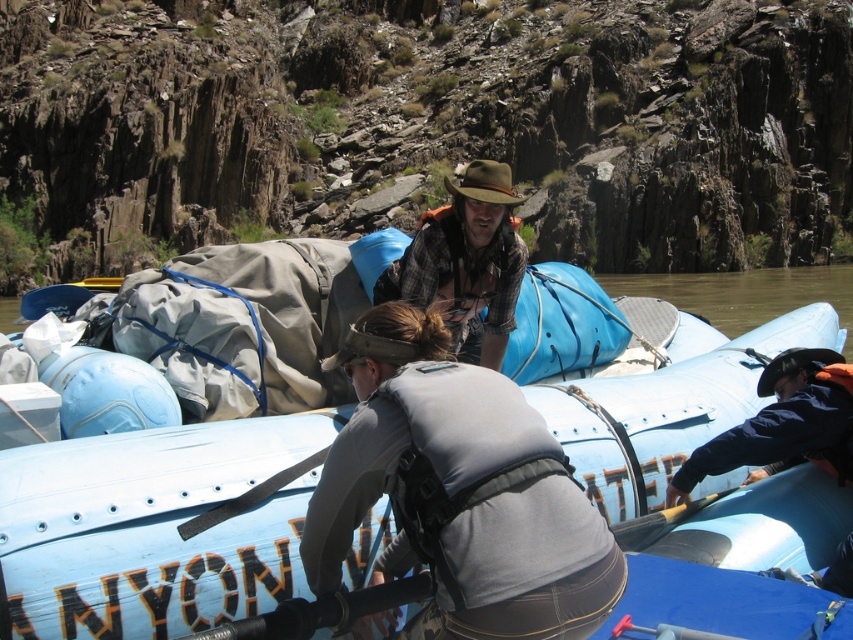
This screenshot has width=853, height=640. I want to click on gray fabric life vest at center, so click(x=460, y=490).

Is point (21, 452) positioned after point (457, 301)?

That is False.

Describe the element at coordinates (154, 525) in the screenshot. The width and height of the screenshot is (853, 640). I see `blue rubber boat at center` at that location.

Where is `blue rubber boat at center`? blue rubber boat at center is located at coordinates (154, 525).

Consider the image. Is blue rubber boat at center to the left of gray fabric life vest at center from the viewer's perspective?

No, blue rubber boat at center is not to the left of gray fabric life vest at center.

Between point (68, 454) and point (486, 625), which one is positioned behind?

Point (68, 454)

The image size is (853, 640). What are the coordinates of `blue rubber boat at center` in the screenshot? It's located at (154, 525).

The width and height of the screenshot is (853, 640). In order to click on blue rubber boat at center in this screenshot , I will do `click(154, 525)`.